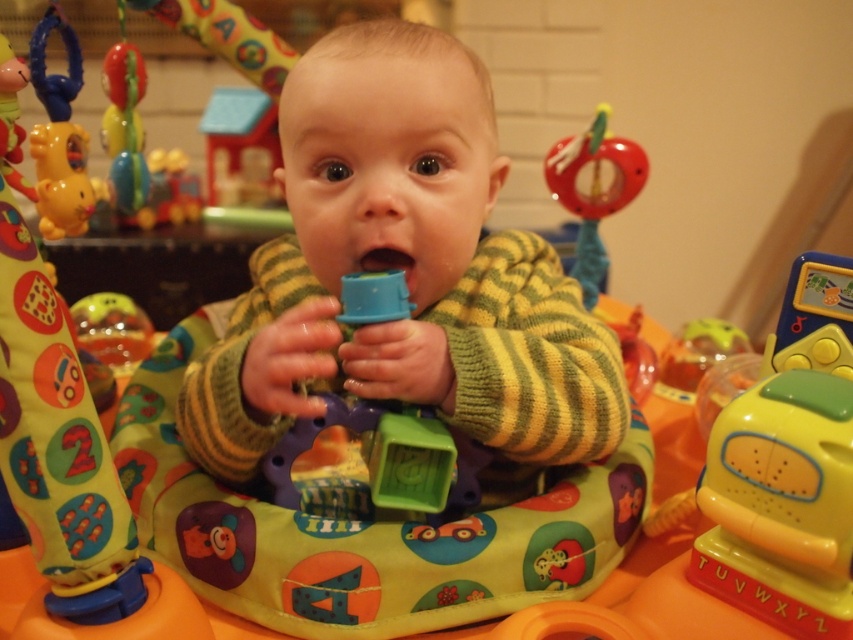
Question: Is blue plastic cup at center above translucent plastic ball at lower left?

Choices:
 (A) yes
 (B) no

Answer: (B)

Question: Among these objects, which one is farthest from the camera?

Choices:
 (A) knitted green sweater at center
 (B) translucent plastic cup at center
 (C) translucent plastic ball at lower left

Answer: (C)

Question: Which object is closer to the camera taking this photo?

Choices:
 (A) blue rubber mouth at center
 (B) translucent plastic ball at lower left
 (C) rubberized red teething ring at upper right
 (D) blue plastic cup at center

Answer: (D)

Question: Which object appears closest to the camera in this image?

Choices:
 (A) knitted green sweater at center
 (B) translucent plastic ball at lower left
 (C) blue plastic cup at center

Answer: (A)

Question: Does translucent plastic ball at lower left lie behind blue rubber mouth at center?

Choices:
 (A) no
 (B) yes

Answer: (B)

Question: Is knitted green sweater at center wider than translucent plastic ball at lower left?

Choices:
 (A) yes
 (B) no

Answer: (A)